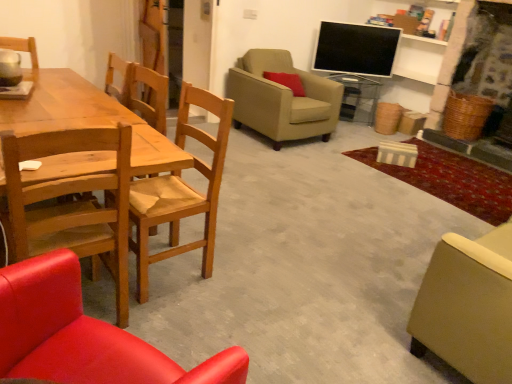
The width and height of the screenshot is (512, 384). In order to click on vacant location below wooden chair at left, which is counted as the fourth chair, starting from the front (from a real-world perspective) in this screenshot , I will do `click(173, 266)`.